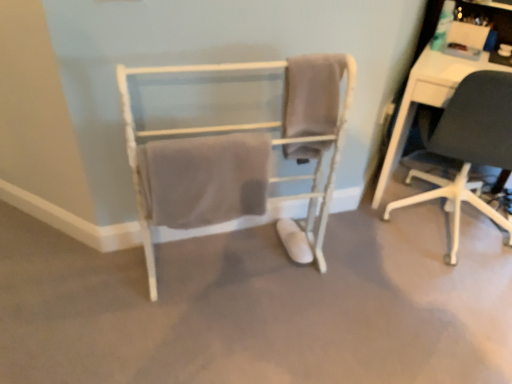
Question: Is black matte chair at right, the 1th chair positioned from the right, smaller than beige cotton towel at center, arranged as the 1th bath towel when viewed from the left?

Choices:
 (A) no
 (B) yes

Answer: (A)

Question: From a real-world perspective, is black matte chair at right, the 2th chair viewed from the left, positioned under beige cotton towel at center, which appears as the 2th bath towel when viewed from the right, based on gravity?

Choices:
 (A) yes
 (B) no

Answer: (A)

Question: Is beige cotton towel at center, which appears as the 2th bath towel when viewed from the right, located within black matte chair at right, the 1th chair positioned from the right?

Choices:
 (A) yes
 (B) no

Answer: (B)

Question: Is black matte chair at right, the 2th chair viewed from the left, turned away from beige cotton towel at center, which appears as the 2th bath towel when viewed from the right?

Choices:
 (A) yes
 (B) no

Answer: (B)

Question: Considering the relative sizes of black matte chair at right, the 1th chair positioned from the right, and beige cotton towel at center, which appears as the 2th bath towel when viewed from the right, in the image provided, is black matte chair at right, the 1th chair positioned from the right, taller than beige cotton towel at center, which appears as the 2th bath towel when viewed from the right,?

Choices:
 (A) yes
 (B) no

Answer: (A)

Question: In terms of size, does beige fabric towel at center, which is the first bath towel from right to left, appear bigger or smaller than black matte chair at right, the 2th chair viewed from the left?

Choices:
 (A) big
 (B) small

Answer: (B)

Question: From the image's perspective, relative to black matte chair at right, the 1th chair positioned from the right, is beige fabric towel at center, which ranks as the second bath towel in left-to-right order, above or below?

Choices:
 (A) above
 (B) below

Answer: (A)

Question: Considering the positions of beige fabric towel at center, which is the first bath towel from right to left, and black matte chair at right, the 2th chair viewed from the left, in the image, is beige fabric towel at center, which is the first bath towel from right to left, taller or shorter than black matte chair at right, the 2th chair viewed from the left,?

Choices:
 (A) tall
 (B) short

Answer: (B)

Question: Do you think beige fabric towel at center, which is the first bath towel from right to left, is within black matte chair at right, the 1th chair positioned from the right, or outside of it?

Choices:
 (A) inside
 (B) outside

Answer: (B)

Question: Looking at their shapes, would you say white wood towel rack at center, which is counted as the 1th chair, starting from the left, is wider or thinner than beige fabric towel at center, which is the first bath towel from right to left?

Choices:
 (A) thin
 (B) wide

Answer: (B)

Question: From a real-world perspective, is white wood towel rack at center, which ranks as the 2th chair in right-to-left order, physically located above or below beige fabric towel at center, which is the first bath towel from right to left?

Choices:
 (A) below
 (B) above

Answer: (A)

Question: Which is correct: white wood towel rack at center, which ranks as the 2th chair in right-to-left order, is inside beige fabric towel at center, which ranks as the second bath towel in left-to-right order, or outside of it?

Choices:
 (A) inside
 (B) outside

Answer: (B)

Question: Looking at the image, does white wood towel rack at center, which ranks as the 2th chair in right-to-left order, seem bigger or smaller compared to beige fabric towel at center, which ranks as the second bath towel in left-to-right order?

Choices:
 (A) big
 (B) small

Answer: (A)

Question: Is point (463, 104) positioned closer to the camera than point (187, 180)?

Choices:
 (A) farther
 (B) closer

Answer: (A)

Question: From a real-world perspective, relative to beige cotton towel at center, arranged as the 1th bath towel when viewed from the left, is black matte chair at right, the 2th chair viewed from the left, vertically above or below?

Choices:
 (A) below
 (B) above

Answer: (A)